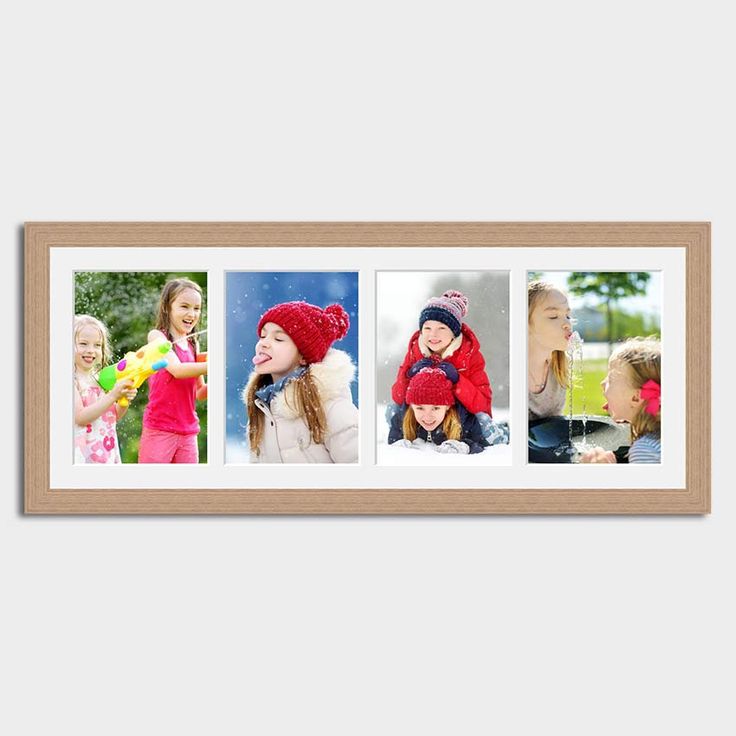
The height and width of the screenshot is (736, 736). In order to click on photos in a collage frame in this screenshot , I will do `click(157, 375)`, `click(269, 378)`, `click(403, 381)`, `click(601, 397)`.